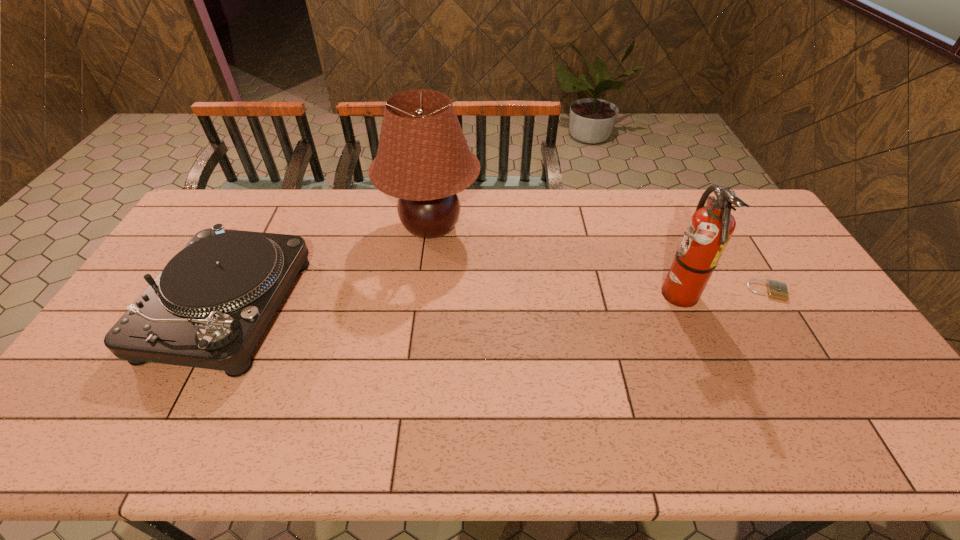
Where is `vacant area that lies between the record player and the fire extinguisher`? Image resolution: width=960 pixels, height=540 pixels. vacant area that lies between the record player and the fire extinguisher is located at coordinates (451, 301).

The height and width of the screenshot is (540, 960). I want to click on vacant area between the lampshade and the shortest object, so click(x=599, y=259).

At what (x,y) coordinates should I click in order to perform the action: click on vacant region between the leftmost object and the third object from right to left. Please return your answer as a coordinate pair (x, y). Image resolution: width=960 pixels, height=540 pixels. Looking at the image, I should click on (329, 267).

What are the coordinates of `free space between the fire extinguisher and the second object from left to right` in the screenshot? It's located at (552, 261).

Locate an element on the screen. The width and height of the screenshot is (960, 540). free space between the third object from right to left and the record player is located at coordinates (329, 267).

This screenshot has width=960, height=540. I want to click on free spot between the padlock and the fire extinguisher, so click(721, 293).

Locate an element on the screen. Image resolution: width=960 pixels, height=540 pixels. vacant space that's between the padlock and the leftmost object is located at coordinates (498, 300).

This screenshot has width=960, height=540. Identify the location of vacant space that's between the third tallest object and the rightmost object. (498, 300).

Identify which object is located as the second nearest to the second object from right to left. Please provide its 2D coordinates. Your answer should be formatted as a tuple, i.e. [(x, y)], where the tuple contains the x and y coordinates of a point satisfying the conditions above.

[(423, 159)]

The height and width of the screenshot is (540, 960). I want to click on object that is the closest to the lampshade, so click(x=208, y=308).